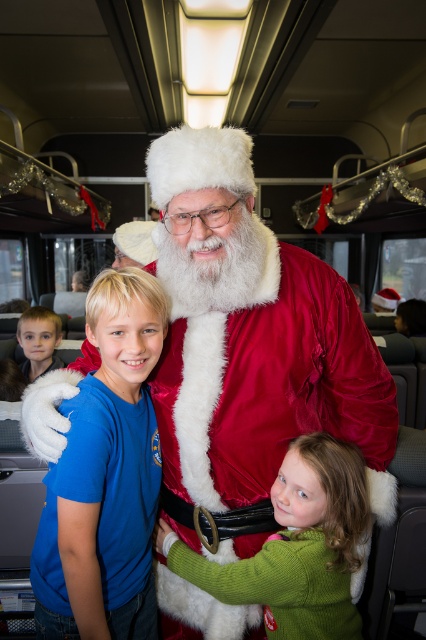
Is blue cotton shirt at center positioned behind green fuzzy sweater at lower center?

No, blue cotton shirt at center is closer to the viewer.

Identify the location of blue cotton shirt at center. This screenshot has height=640, width=426. (106, 477).

Is green fuzzy sweater at lower center above light brown hair at left?

No, green fuzzy sweater at lower center is not above light brown hair at left.

Which is in front, point (273, 497) or point (43, 324)?

Point (273, 497) is more forward.

Identify the location of green fuzzy sweater at lower center. (296, 547).

Between point (391, 481) and point (46, 355), which one is positioned behind?

Positioned behind is point (46, 355).

Who is shorter, velvet red santa at center or light brown hair at left?

light brown hair at left

Is point (288, 266) closer to camera compared to point (45, 324)?

That is True.

This screenshot has width=426, height=640. I want to click on velvet red santa at center, so click(250, 344).